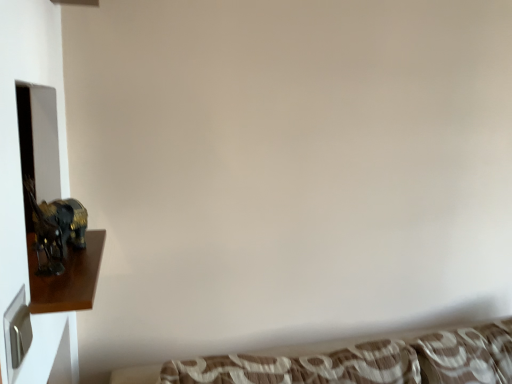
You are a GUI agent. You are given a task and a screenshot of the screen. Output one action in this format:
    pyautogui.click(x=<x>, y=<y>)
    Task: Click on the brown textured fabric at lower center
    Image resolution: width=512 pixels, height=384 pixels.
    Given the screenshot: What is the action you would take?
    pyautogui.click(x=353, y=362)

The image size is (512, 384). What do you see at coordinates (353, 362) in the screenshot?
I see `brown textured fabric at lower center` at bounding box center [353, 362].

In order to face brown textured fabric at lower center, should I rotate leftwards or rightwards?

To face it directly, rotate right by 5.391 degrees.

The width and height of the screenshot is (512, 384). What do you see at coordinates (67, 277) in the screenshot? I see `shiny gold statue at left` at bounding box center [67, 277].

In order to face shiny gold statue at left, should I rotate leftwards or rightwards?

Rotate your view left by about 22.791°.

Image resolution: width=512 pixels, height=384 pixels. In order to click on shiny gold statue at left in this screenshot , I will do `click(67, 277)`.

What is the approximate height of shiny gold statue at left?

shiny gold statue at left is 1.03 inches tall.

What are the coordinates of `brown textured fabric at lower center` in the screenshot? It's located at (353, 362).

Considering the positions of objects shiny gold statue at left and brown textured fabric at lower center in the image provided, who is more to the left, shiny gold statue at left or brown textured fabric at lower center?

Positioned to the left is shiny gold statue at left.

Is shiny gold statue at left behind brown textured fabric at lower center?

No, the depth of shiny gold statue at left is less than that of brown textured fabric at lower center.

Is point (46, 302) positioned behind point (279, 376)?

No, it is in front of (279, 376).

From the image's perspective, is shiny gold statue at left located above brown textured fabric at lower center?

Yes, from the image's perspective, shiny gold statue at left is above brown textured fabric at lower center.

From a real-world perspective, is shiny gold statue at left under brown textured fabric at lower center?

No, from a real-world perspective, shiny gold statue at left is not below brown textured fabric at lower center.

Considering the sizes of objects shiny gold statue at left and brown textured fabric at lower center in the image provided, who is thinner, shiny gold statue at left or brown textured fabric at lower center?

Thinner between the two is shiny gold statue at left.

Considering the sizes of shiny gold statue at left and brown textured fabric at lower center in the image, is shiny gold statue at left taller or shorter than brown textured fabric at lower center?

shiny gold statue at left is shorter than brown textured fabric at lower center.

Who is smaller, shiny gold statue at left or brown textured fabric at lower center?

shiny gold statue at left.

Is shiny gold statue at left spatially inside brown textured fabric at lower center, or outside of it?

shiny gold statue at left is not inside brown textured fabric at lower center, it's outside.

Is shiny gold statue at left positioned far away from brown textured fabric at lower center?

No, there isn't a large distance between shiny gold statue at left and brown textured fabric at lower center.

Is shiny gold statue at left oriented towards brown textured fabric at lower center?

No, shiny gold statue at left is not aimed at brown textured fabric at lower center.

Image resolution: width=512 pixels, height=384 pixels. What are the coordinates of `studio couch behind the shiny gold statue at left` in the screenshot? It's located at (353, 362).

Considering the relative positions of brown textured fabric at lower center and shiny gold statue at left in the image provided, is brown textured fabric at lower center to the left or to the right of shiny gold statue at left?

brown textured fabric at lower center is to the right of shiny gold statue at left.

Is brown textured fabric at lower center positioned before shiny gold statue at left?

That is False.

Does point (472, 356) come in front of point (71, 253)?

No, (472, 356) is behind (71, 253).

From the image's perspective, is brown textured fabric at lower center located above or below shiny gold statue at left?

brown textured fabric at lower center is situated lower than shiny gold statue at left in the image.

From a real-world perspective, which object stands above the other?

shiny gold statue at left, from a real-world perspective.

Does brown textured fabric at lower center have a greater width compared to shiny gold statue at left?

Indeed, brown textured fabric at lower center has a greater width compared to shiny gold statue at left.

Which of these two, brown textured fabric at lower center or shiny gold statue at left, stands shorter?

shiny gold statue at left.

Which of these two, brown textured fabric at lower center or shiny gold statue at left, is smaller?

shiny gold statue at left.

Is brown textured fabric at lower center outside of shiny gold statue at left?

That's correct, brown textured fabric at lower center is outside of shiny gold statue at left.

Can you see brown textured fabric at lower center touching shiny gold statue at left?

No, brown textured fabric at lower center is not beside shiny gold statue at left.

Is brown textured fabric at lower center oriented away from shiny gold statue at left?

No, shiny gold statue at left is not at the back of brown textured fabric at lower center.

Image resolution: width=512 pixels, height=384 pixels. What are the coordinates of `studio couch below the shiny gold statue at left (from the image's perspective)` in the screenshot? It's located at (353, 362).

The image size is (512, 384). Identify the location of studio couch below the shiny gold statue at left (from the image's perspective). (353, 362).

This screenshot has height=384, width=512. In order to click on studio couch behind the shiny gold statue at left in this screenshot , I will do `click(353, 362)`.